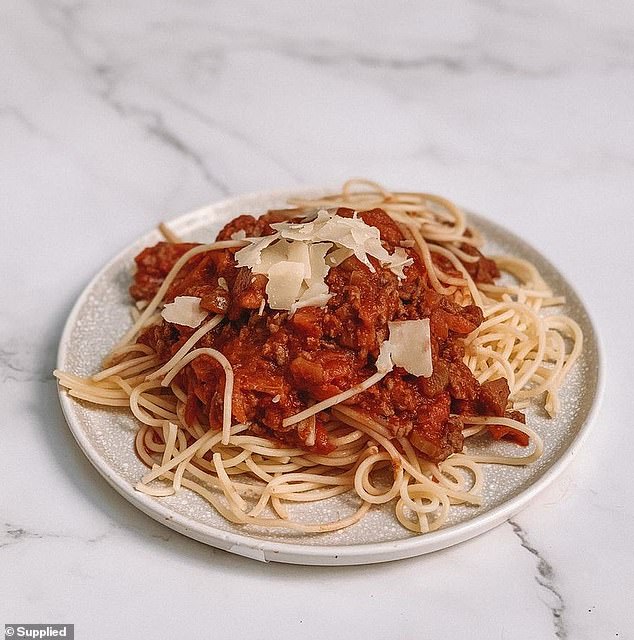
Where is `white flat plate`? The width and height of the screenshot is (634, 640). white flat plate is located at coordinates (317, 550).